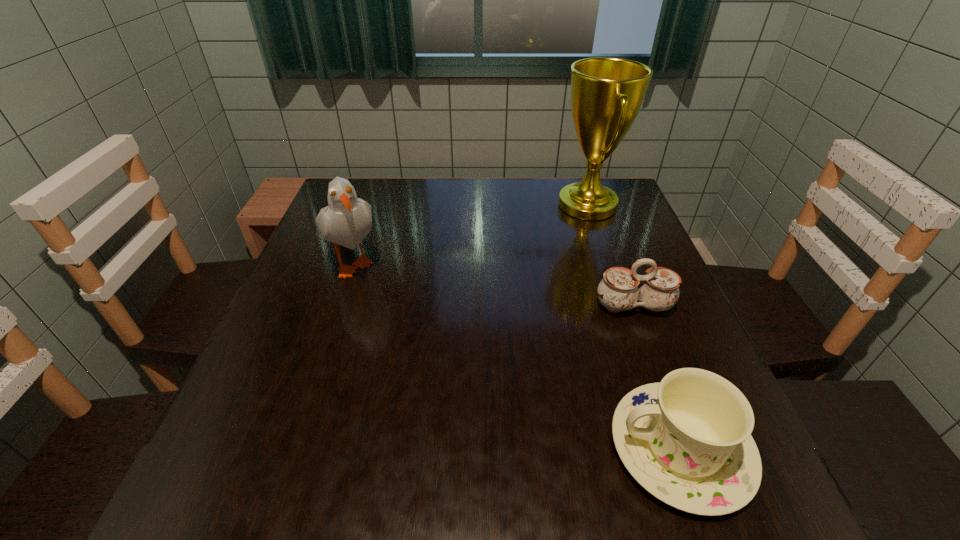
Locate an element on the screen. This screenshot has width=960, height=540. free region located 0.210m on the handle side of the nearer chinaware is located at coordinates (478, 449).

Locate an element on the screen. The width and height of the screenshot is (960, 540). vacant space located on the handle side of the nearer chinaware is located at coordinates (471, 449).

The width and height of the screenshot is (960, 540). Find the location of `free location located on the handle side of the nearer chinaware`. free location located on the handle side of the nearer chinaware is located at coordinates (510, 449).

The width and height of the screenshot is (960, 540). Find the location of `object present at the far edge`. object present at the far edge is located at coordinates (607, 93).

The width and height of the screenshot is (960, 540). In order to click on object situated at the near edge in this screenshot , I will do `click(687, 440)`.

This screenshot has height=540, width=960. Find the location of `object present at the left edge`. object present at the left edge is located at coordinates (347, 220).

Where is `award located in the right edge section of the desktop`? award located in the right edge section of the desktop is located at coordinates tap(607, 93).

Locate an element on the screen. object present at the far right corner is located at coordinates (607, 93).

The width and height of the screenshot is (960, 540). Find the location of `object at the near right corner`. object at the near right corner is located at coordinates (687, 440).

This screenshot has height=540, width=960. Find the location of `free region at the far edge`. free region at the far edge is located at coordinates pos(553,205).